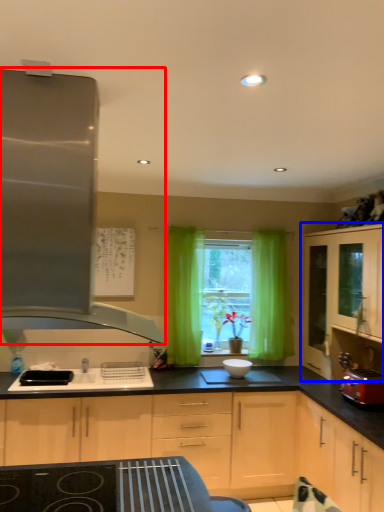
Question: Which of the following is the closest to the observer, kitchen appliance (highlighted by a red box) or cabinetry (highlighted by a blue box)?

Choices:
 (A) kitchen appliance
 (B) cabinetry

Answer: (A)